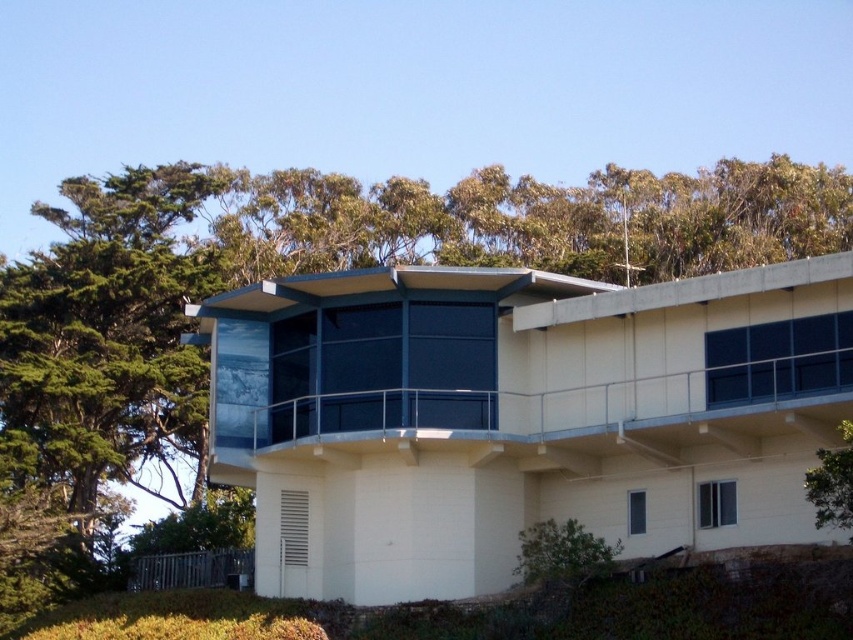
The image size is (853, 640). What do you see at coordinates (395, 307) in the screenshot?
I see `green leafy tree at upper left` at bounding box center [395, 307].

Does green leafy tree at upper left appear on the right side of white smooth balcony at center?

Yes, green leafy tree at upper left is to the right of white smooth balcony at center.

Where is `green leafy tree at upper left`? This screenshot has width=853, height=640. green leafy tree at upper left is located at coordinates (395, 307).